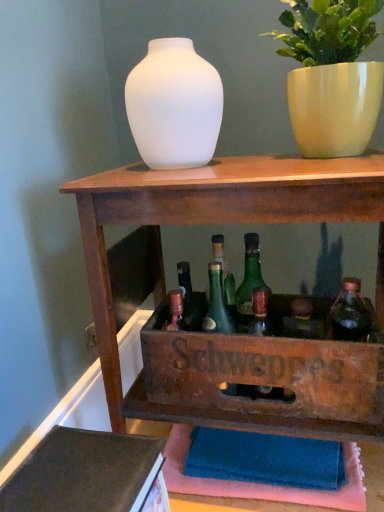
Question: Considering the relative sizes of frosted glass vase at center and white glossy pot at upper right in the image provided, is frosted glass vase at center taller than white glossy pot at upper right?

Choices:
 (A) yes
 (B) no

Answer: (B)

Question: Does frosted glass vase at center contain white glossy pot at upper right?

Choices:
 (A) yes
 (B) no

Answer: (B)

Question: Can you confirm if frosted glass vase at center is positioned to the left of white glossy pot at upper right?

Choices:
 (A) no
 (B) yes

Answer: (B)

Question: Is frosted glass vase at center oriented towards white glossy pot at upper right?

Choices:
 (A) no
 (B) yes

Answer: (A)

Question: Is frosted glass vase at center oriented away from white glossy pot at upper right?

Choices:
 (A) no
 (B) yes

Answer: (A)

Question: Is green glass bottle at center, the first bottle in the left-to-right sequence, spatially inside translucent glass bottle at center-right, the second bottle viewed from the left, or outside of it?

Choices:
 (A) inside
 (B) outside

Answer: (B)

Question: From a real-world perspective, relative to translucent glass bottle at center-right, which is the first bottle from right to left, is green glass bottle at center, the 2th bottle positioned from the right, vertically above or below?

Choices:
 (A) above
 (B) below

Answer: (B)

Question: Looking at their shapes, would you say green glass bottle at center, the 2th bottle positioned from the right, is wider or thinner than translucent glass bottle at center-right, the second bottle viewed from the left?

Choices:
 (A) wide
 (B) thin

Answer: (A)

Question: In the image, is green glass bottle at center, the first bottle in the left-to-right sequence, positioned in front of or behind translucent glass bottle at center-right, which is the first bottle from right to left?

Choices:
 (A) behind
 (B) front

Answer: (A)

Question: From their relative heights in the image, would you say wooden shelf at center is taller or shorter than translucent glass bottle at center-right, which is the first bottle from right to left?

Choices:
 (A) tall
 (B) short

Answer: (A)

Question: Is wooden shelf at center to the left or to the right of translucent glass bottle at center-right, which is the first bottle from right to left, in the image?

Choices:
 (A) right
 (B) left

Answer: (B)

Question: Is wooden shelf at center in front of or behind translucent glass bottle at center-right, which is the first bottle from right to left, in the image?

Choices:
 (A) front
 (B) behind

Answer: (A)

Question: Is point (238, 362) positioned closer to the camera than point (360, 309)?

Choices:
 (A) closer
 (B) farther

Answer: (A)

Question: Considering the positions of green glass bottle at center and white glossy pot at upper right in the image, is green glass bottle at center taller or shorter than white glossy pot at upper right?

Choices:
 (A) short
 (B) tall

Answer: (A)

Question: From a real-world perspective, relative to white glossy pot at upper right, is green glass bottle at center vertically above or below?

Choices:
 (A) below
 (B) above

Answer: (A)